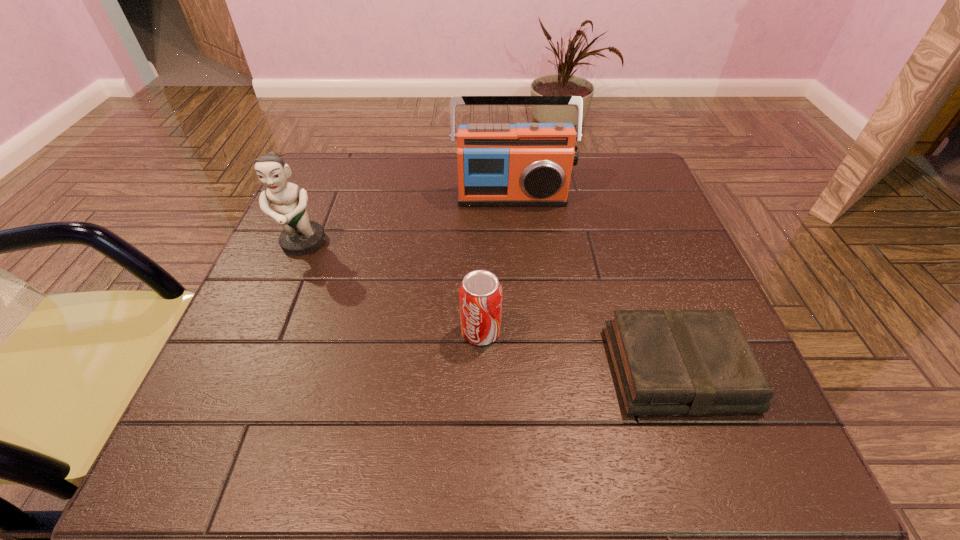
This screenshot has height=540, width=960. I want to click on free space that is in between the book and the farthest object, so click(594, 283).

The width and height of the screenshot is (960, 540). Find the location of `vacant space in between the soda can and the third nearest object`. vacant space in between the soda can and the third nearest object is located at coordinates pyautogui.click(x=392, y=288).

Find the location of `empty space between the radio receiver and the shortest object`. empty space between the radio receiver and the shortest object is located at coordinates (594, 283).

You are a GUI agent. You are given a task and a screenshot of the screen. Output one action in this format:
    pyautogui.click(x=<x>, y=<y>)
    Task: Click on the free space between the farthest object and the shortest object
    The width and height of the screenshot is (960, 540).
    Given the screenshot: What is the action you would take?
    pyautogui.click(x=594, y=283)

What are the coordinates of `vacant region between the shortest object and the farthest object` in the screenshot? It's located at (594, 283).

The height and width of the screenshot is (540, 960). I want to click on free space between the farthest object and the third nearest object, so click(x=407, y=220).

This screenshot has width=960, height=540. In order to click on free space between the third tallest object and the book in this screenshot , I will do `click(579, 350)`.

Locate an element on the screen. The width and height of the screenshot is (960, 540). free spot between the third nearest object and the third tallest object is located at coordinates (392, 288).

You are a GUI agent. You are given a task and a screenshot of the screen. Output one action in this format:
    pyautogui.click(x=<x>, y=<y>)
    Task: Click on the free space between the second farthest object and the farthest object
    The height and width of the screenshot is (540, 960).
    Given the screenshot: What is the action you would take?
    pyautogui.click(x=407, y=220)

Identify the location of free space that is in between the radio receiver and the figurine. (407, 220).